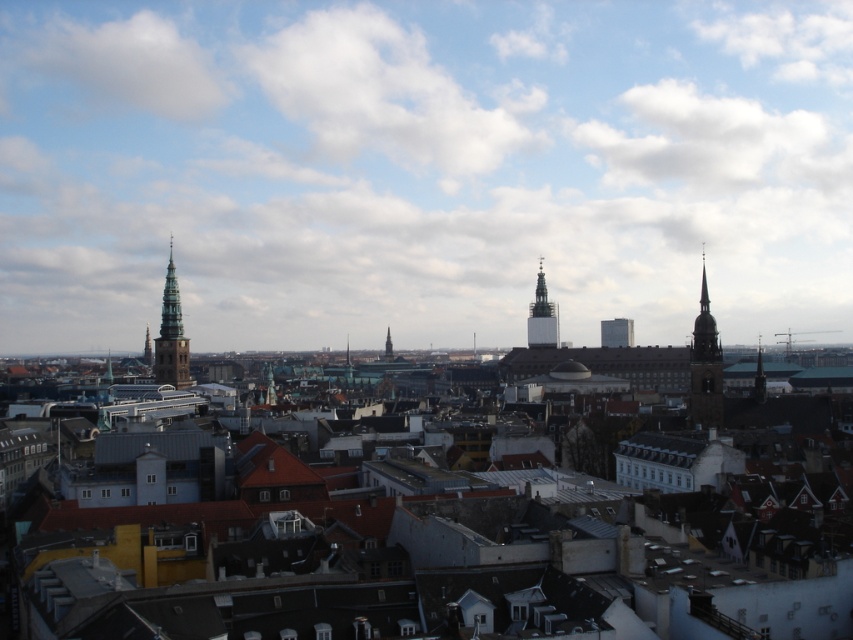
Between point (689, 396) and point (759, 369), which one is positioned behind?

Point (689, 396)

At what (x,y) coordinates should I click in order to perform the action: click on brown stone tower at right. Please return your answer as a coordinate pair (x, y). Image resolution: width=853 pixels, height=640 pixels. Looking at the image, I should click on (705, 365).

The height and width of the screenshot is (640, 853). What are the coordinates of `brown stone tower at right` in the screenshot? It's located at (705, 365).

The image size is (853, 640). I want to click on brown stone tower at right, so click(705, 365).

This screenshot has width=853, height=640. Identify the location of brown stone tower at right. (705, 365).

Does brown stone tower at right appear on the left side of smooth gray spire at center-left?

Incorrect, brown stone tower at right is not on the left side of smooth gray spire at center-left.

Identify the location of brown stone tower at right. The image size is (853, 640). (705, 365).

You are a GUI agent. You are given a task and a screenshot of the screen. Output one action in this format:
    pyautogui.click(x=<x>, y=<y>)
    Task: Click on the brown stone tower at right
    The width and height of the screenshot is (853, 640).
    Given the screenshot: What is the action you would take?
    pyautogui.click(x=705, y=365)

The height and width of the screenshot is (640, 853). In order to click on smooth white tower at center in this screenshot , I will do `click(543, 316)`.

Can you confirm if smooth white tower at center is wider than dark brown stone spire at right?

In fact, smooth white tower at center might be narrower than dark brown stone spire at right.

Where is `smooth white tower at center`? The height and width of the screenshot is (640, 853). smooth white tower at center is located at coordinates (543, 316).